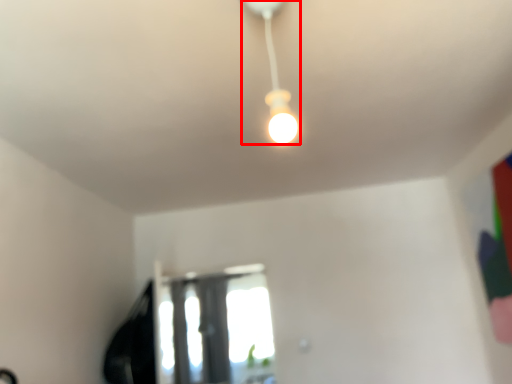
Question: From the image's perspective, where is lamp (annotated by the red box) located relative to window?

Choices:
 (A) below
 (B) above

Answer: (B)